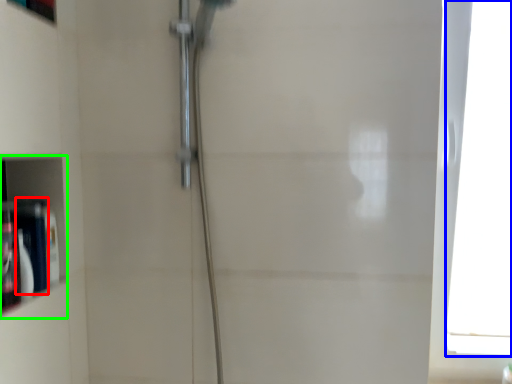
Question: Which object is the farthest from toiletry (highlighted by a red box)? Choose among these: window (highlighted by a blue box) or cabinet (highlighted by a green box).

Choices:
 (A) window
 (B) cabinet

Answer: (A)